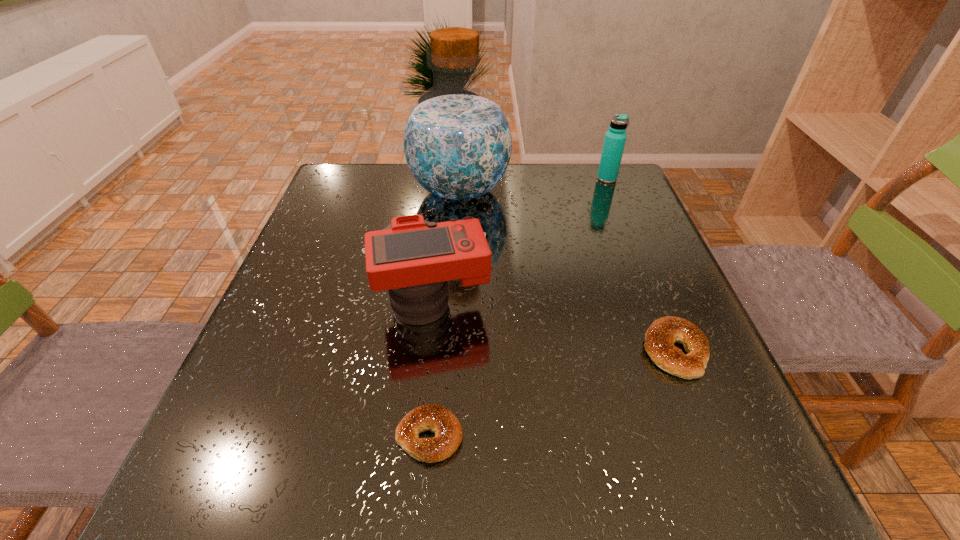
At what (x,y) coordinates should I click in order to perform the action: click on vacant space at the right edge. Please return your answer as a coordinate pair (x, y). This screenshot has height=540, width=960. Looking at the image, I should click on (651, 235).

You are a GUI agent. You are given a task and a screenshot of the screen. Output one action in this format:
    pyautogui.click(x=<x>, y=<y>)
    Task: Click on the blank space at the far left corner of the desktop
    The width and height of the screenshot is (960, 540).
    Given the screenshot: What is the action you would take?
    pyautogui.click(x=343, y=171)

The image size is (960, 540). In order to click on vacant space at the far right corner of the desktop in this screenshot , I will do `click(620, 192)`.

Where is `empty space between the tallest object and the right bagel`? The width and height of the screenshot is (960, 540). empty space between the tallest object and the right bagel is located at coordinates (567, 271).

Image resolution: width=960 pixels, height=540 pixels. Find the location of `free space between the right bagel and the shorter bagel`. free space between the right bagel and the shorter bagel is located at coordinates (552, 394).

This screenshot has height=540, width=960. I want to click on vacant space in between the shortest object and the water bottle, so click(x=518, y=307).

Where is `free space between the water bottle and the taller bagel`? Image resolution: width=960 pixels, height=540 pixels. free space between the water bottle and the taller bagel is located at coordinates (641, 265).

Find the location of a particular element. free space between the water bottle and the tallest object is located at coordinates (534, 185).

What are the coordinates of `object that stands as the third closest to the camera` in the screenshot? It's located at (660, 337).

Select which object is the fourth closest to the camera. Please provide its 2D coordinates. Your answer should be formatted as a tuple, i.e. [(x, y)], where the tuple contains the x and y coordinates of a point satisfying the conditions above.

[(615, 138)]